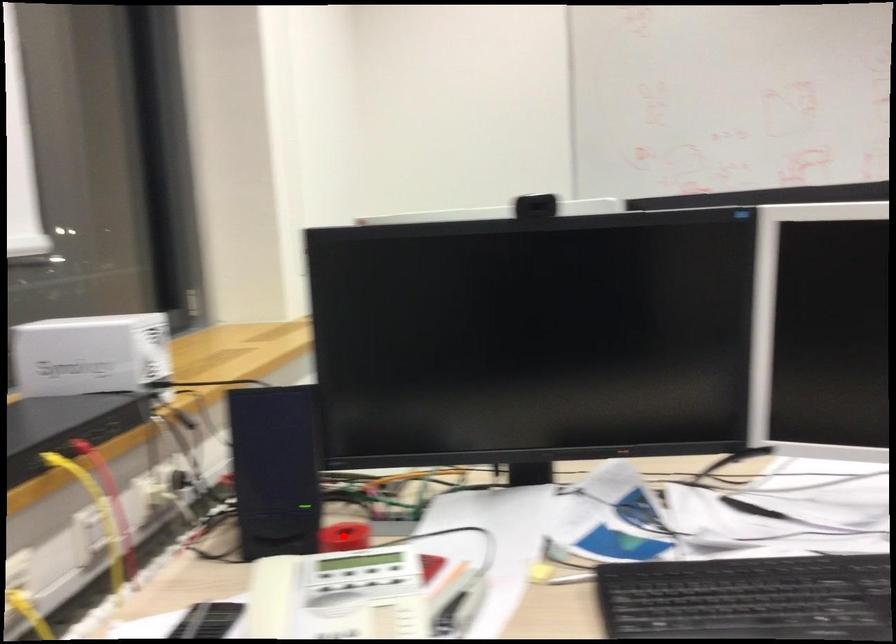
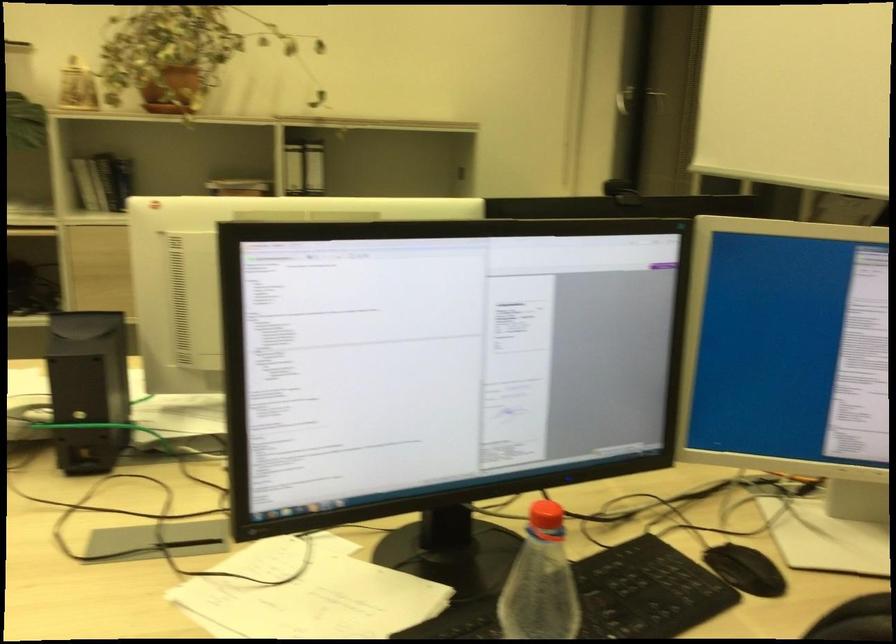
Question: I am providing you with two images of the same scene from different viewpoints. A red point is marked on the first image. Can you still see the location of the red point in image 2?

Choices:
 (A) Yes
 (B) No

Answer: (B)